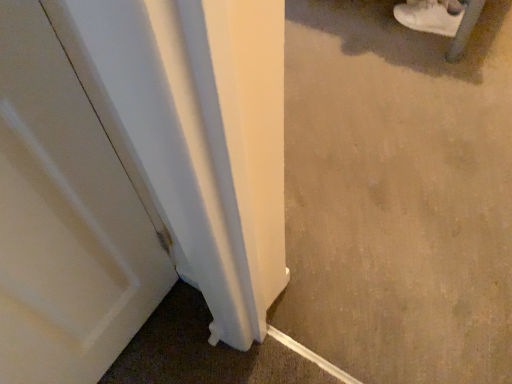
Question: From a real-world perspective, is beige carpet at lower right above or below white suede shoe at upper right?

Choices:
 (A) above
 (B) below

Answer: (A)

Question: Considering the relative positions of beige carpet at lower right and white suede shoe at upper right in the image provided, is beige carpet at lower right to the left or to the right of white suede shoe at upper right?

Choices:
 (A) left
 (B) right

Answer: (A)

Question: Is beige carpet at lower right spatially inside white suede shoe at upper right, or outside of it?

Choices:
 (A) outside
 (B) inside

Answer: (A)

Question: In the image, is white suede shoe at upper right positioned in front of or behind beige carpet at lower right?

Choices:
 (A) front
 (B) behind

Answer: (B)

Question: From the image's perspective, is white suede shoe at upper right located above or below beige carpet at lower right?

Choices:
 (A) below
 (B) above

Answer: (B)

Question: Is point (411, 8) positioned closer to the camera than point (307, 96)?

Choices:
 (A) closer
 (B) farther

Answer: (B)

Question: Is white suede shoe at upper right to the left or to the right of beige carpet at lower right in the image?

Choices:
 (A) right
 (B) left

Answer: (A)